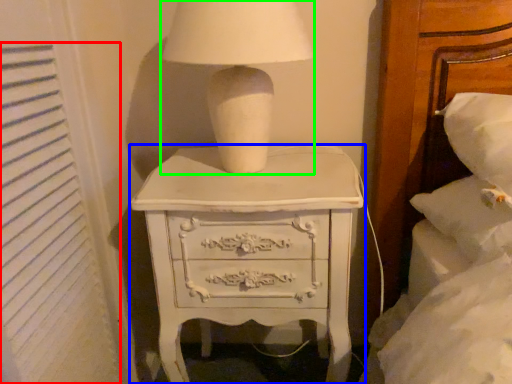
Question: Which object is positioned closest to curtain (highlighted by a red box)? Select from chest of drawers (highlighted by a blue box) and table lamp (highlighted by a green box).

Choices:
 (A) chest of drawers
 (B) table lamp

Answer: (A)